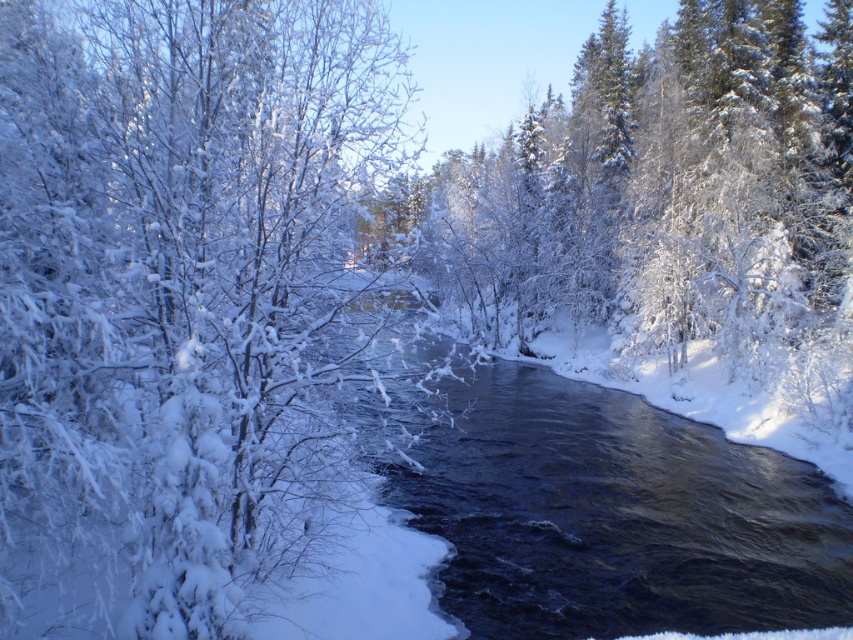
You are standing in the winter landscape and want to reach the point marked as point (30, 481). If you can walk 1.5 meters per second, how long will it take you to reach that point?

The point (30, 481) is 6.90 meters from viewer. At a walking speed of 1.5 meters per second, it will take approximately 4.6 seconds to reach the point.

You are an artist sketching the winter scene. You need to draw the snowy white branches at left and the dark blue water at center. Which object should you sketch first to maintain the correct spatial arrangement?

The snowy white branches at left should be sketched first because they are positioned on the left side of the dark blue water at center, so they appear in front of the water in the composition.